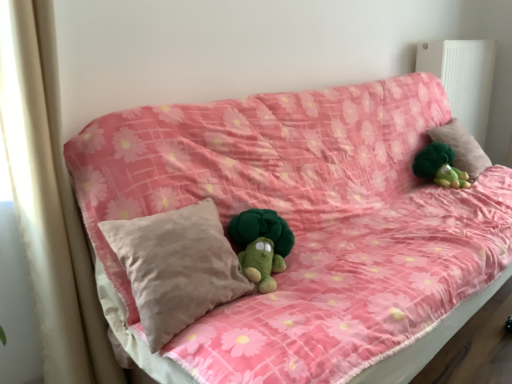
Question: From a real-world perspective, is pink fabric couch at center below beige fabric curtain at left?

Choices:
 (A) yes
 (B) no

Answer: (A)

Question: Considering the relative sizes of pink fabric couch at center and beige fabric curtain at left in the image provided, is pink fabric couch at center bigger than beige fabric curtain at left?

Choices:
 (A) yes
 (B) no

Answer: (A)

Question: From the image's perspective, does pink fabric couch at center appear higher than beige fabric curtain at left?

Choices:
 (A) no
 (B) yes

Answer: (B)

Question: Is pink fabric couch at center oriented away from beige fabric curtain at left?

Choices:
 (A) no
 (B) yes

Answer: (A)

Question: Would you say beige fabric curtain at left is part of pink fabric couch at center's contents?

Choices:
 (A) yes
 (B) no

Answer: (B)

Question: Does pink fabric couch at center have a smaller size compared to beige fabric curtain at left?

Choices:
 (A) no
 (B) yes

Answer: (A)

Question: Does beige cotton pillow at upper right, the second pillow in the front-to-back sequence, turn towards white plastic radiator at upper right?

Choices:
 (A) yes
 (B) no

Answer: (B)

Question: Does beige cotton pillow at upper right, which ranks as the 2th pillow in bottom-to-top order, contain white plastic radiator at upper right?

Choices:
 (A) no
 (B) yes

Answer: (A)

Question: Considering the relative positions of beige cotton pillow at upper right, placed as the first pillow when sorted from right to left, and white plastic radiator at upper right in the image provided, is beige cotton pillow at upper right, placed as the first pillow when sorted from right to left, to the left of white plastic radiator at upper right from the viewer's perspective?

Choices:
 (A) no
 (B) yes

Answer: (B)

Question: Would you consider beige cotton pillow at upper right, positioned as the 2th pillow in left-to-right order, to be distant from white plastic radiator at upper right?

Choices:
 (A) yes
 (B) no

Answer: (B)

Question: Does beige cotton pillow at upper right, placed as the first pillow when sorted from right to left, have a lesser width compared to white plastic radiator at upper right?

Choices:
 (A) yes
 (B) no

Answer: (B)

Question: Is beige cotton pillow at upper right, placed as the first pillow when sorted from right to left, outside of white plastic radiator at upper right?

Choices:
 (A) yes
 (B) no

Answer: (A)

Question: From a real-world perspective, is beige soft pillow at center, which ranks as the 1th pillow in bottom-to-top order, located beneath green plush toy at upper right?

Choices:
 (A) yes
 (B) no

Answer: (B)